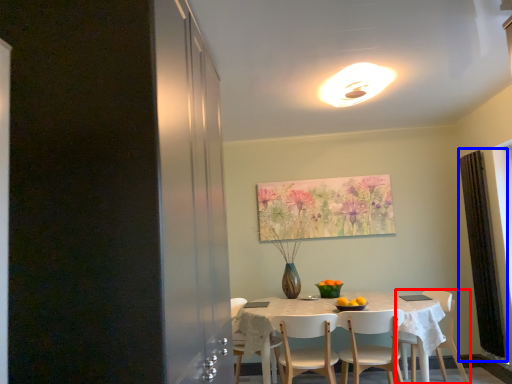
Question: Which point is further to the camera, chair (highlighted by a red box) or curtain (highlighted by a blue box)?

Choices:
 (A) chair
 (B) curtain

Answer: (B)